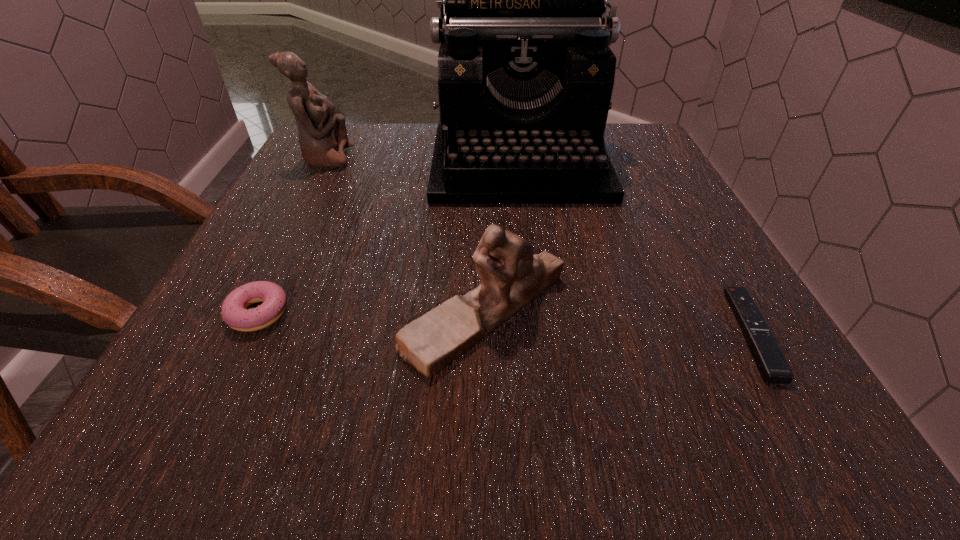
Where is `vacant area situated 0.170m on the front-facing side of the third shortest object`? This screenshot has width=960, height=540. vacant area situated 0.170m on the front-facing side of the third shortest object is located at coordinates (286, 312).

At what (x,y) coordinates should I click in order to perform the action: click on blank space located 0.140m on the front-facing side of the third shortest object. Please return your answer as a coordinate pair (x, y). The height and width of the screenshot is (540, 960). Looking at the image, I should click on (306, 312).

The image size is (960, 540). Identify the location of vacant space located 0.060m on the front-facing side of the third shortest object. (360, 312).

What are the coordinates of `vacant space located 0.230m on the right of the second shortest object` in the screenshot? It's located at (444, 313).

The height and width of the screenshot is (540, 960). In order to click on free space located on the back of the remote control in this screenshot , I will do `click(674, 199)`.

You are a GUI agent. You are given a task and a screenshot of the screen. Output one action in this format:
    pyautogui.click(x=<x>, y=<y>)
    Task: Click on the typewriter located in the far edge section of the desktop
    The height and width of the screenshot is (540, 960).
    Given the screenshot: What is the action you would take?
    pyautogui.click(x=525, y=74)

Where is `figurine that is at the far edge`? This screenshot has height=540, width=960. figurine that is at the far edge is located at coordinates (323, 137).

Find the location of a particular element. object located in the near edge section of the desktop is located at coordinates (773, 367).

Where is `figurine that is at the left edge`? This screenshot has height=540, width=960. figurine that is at the left edge is located at coordinates (323, 137).

The height and width of the screenshot is (540, 960). I want to click on doughnut at the left edge, so click(235, 314).